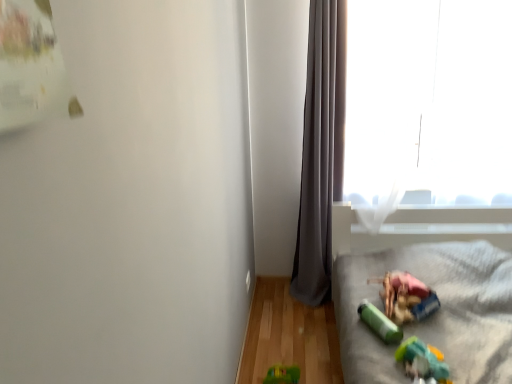
Question: Is plush gray blanket at lower right oriented away from transparent glass window at upper right?

Choices:
 (A) yes
 (B) no

Answer: (B)

Question: Does plush gray blanket at lower right have a larger size compared to transparent glass window at upper right?

Choices:
 (A) yes
 (B) no

Answer: (A)

Question: From the image's perspective, is plush gray blanket at lower right on transparent glass window at upper right?

Choices:
 (A) no
 (B) yes

Answer: (A)

Question: Is plush gray blanket at lower right at the left side of transparent glass window at upper right?

Choices:
 (A) no
 (B) yes

Answer: (B)

Question: Is plush gray blanket at lower right next to transparent glass window at upper right?

Choices:
 (A) no
 (B) yes

Answer: (A)

Question: Which is correct: green rubber toy at lower right, acting as the first toy starting from the back, is inside plastic green toy at lower right, the first toy when ordered from front to back, or outside of it?

Choices:
 (A) inside
 (B) outside

Answer: (B)

Question: Is point (366, 312) positioned closer to the camera than point (445, 365)?

Choices:
 (A) closer
 (B) farther

Answer: (B)

Question: From a real-world perspective, is green rubber toy at lower right, acting as the first toy starting from the back, above or below plastic green toy at lower right, the first toy when ordered from front to back?

Choices:
 (A) above
 (B) below

Answer: (A)

Question: In terms of height, does green rubber toy at lower right, acting as the first toy starting from the back, look taller or shorter compared to plastic green toy at lower right, the first toy when ordered from front to back?

Choices:
 (A) tall
 (B) short

Answer: (A)

Question: Is green rubber toy at lower right, which appears as the second toy when viewed from the front, wider or thinner than green plastic toy at lower right?

Choices:
 (A) thin
 (B) wide

Answer: (A)

Question: Choose the correct answer: Is green rubber toy at lower right, which appears as the second toy when viewed from the front, inside green plastic toy at lower right or outside it?

Choices:
 (A) outside
 (B) inside

Answer: (A)

Question: From the image's perspective, relative to green plastic toy at lower right, is green rubber toy at lower right, acting as the first toy starting from the back, above or below?

Choices:
 (A) below
 (B) above

Answer: (A)

Question: Is green rubber toy at lower right, which appears as the second toy when viewed from the front, taller or shorter than green plastic toy at lower right?

Choices:
 (A) short
 (B) tall

Answer: (A)

Question: From the image's perspective, relative to plush gray blanket at lower right, is transparent glass window at upper right above or below?

Choices:
 (A) below
 (B) above

Answer: (B)

Question: From a real-world perspective, is transparent glass window at upper right above or below plush gray blanket at lower right?

Choices:
 (A) above
 (B) below

Answer: (A)